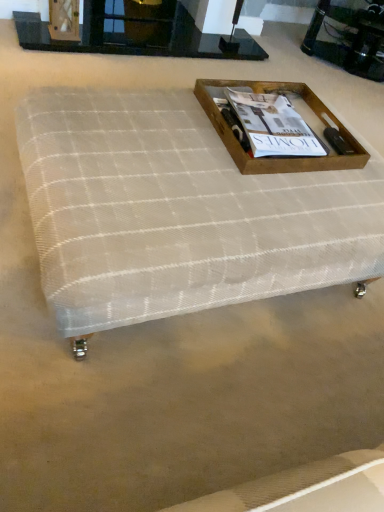
What are the coordinates of `empty space that is ontop of wooden tray at center (from a real-world perspective)` in the screenshot? It's located at (271, 120).